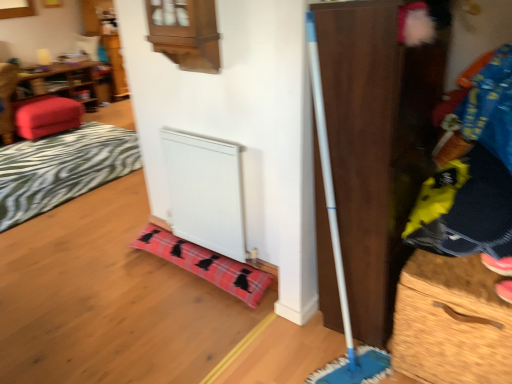
Where is `free region under white matte radiator at lower center (from a real-world perspective)`? free region under white matte radiator at lower center (from a real-world perspective) is located at coordinates (219, 253).